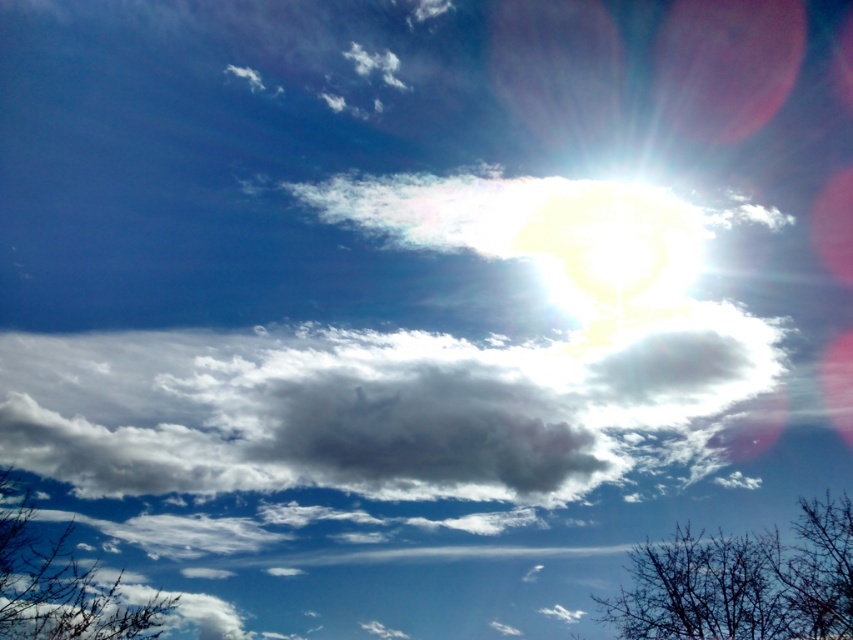
You are an artist painting the sky scene. You want to ensure the white fluffy cloud at center and the bare branches at lower right are proportionally accurate. Which object should you draw larger?

The white fluffy cloud at center should be drawn larger since it is bigger than the bare branches at lower right according to the description.

You are an astronomer observing the sky and want to determine which of the two points, point (160,442) or point (15,486), is closer to the observer. Based on the scene description, which point is nearer?

Point (160,442) is further to the viewer than point (15,486), so point (15,486) is closer to the observer.